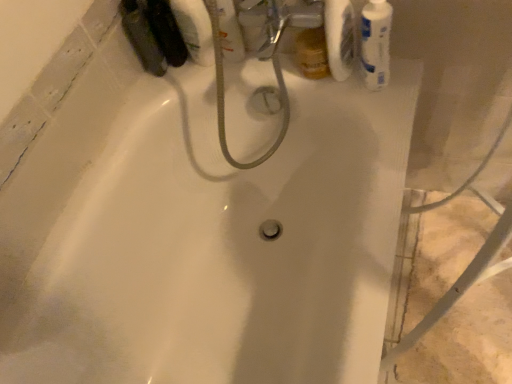
Where is `clear plastic bottle at upper center, which is the 2th mouthwash from right to left`? The height and width of the screenshot is (384, 512). clear plastic bottle at upper center, which is the 2th mouthwash from right to left is located at coordinates (227, 29).

Describe the element at coordinates (142, 37) in the screenshot. I see `matte black bottle at upper left, the third mouthwash in the right-to-left sequence` at that location.

Where is `matte black bottle at upper left, the 1th mouthwash in the left-to-right sequence`? matte black bottle at upper left, the 1th mouthwash in the left-to-right sequence is located at coordinates (142, 37).

What is the approximate height of white matte toilet paper at upper right?

9.28 inches.

Identify the location of clear plastic bottle at upper center, marked as the 2th mouthwash in a left-to-right arrangement. The width and height of the screenshot is (512, 384). (227, 29).

From a real-world perspective, is matte black bottle at upper left, the 1th mouthwash in the left-to-right sequence, physically located above or below white glossy mouthwash at upper right, arranged as the first mouthwash when viewed from the right?

matte black bottle at upper left, the 1th mouthwash in the left-to-right sequence, is below white glossy mouthwash at upper right, arranged as the first mouthwash when viewed from the right.

Between matte black bottle at upper left, the 1th mouthwash in the left-to-right sequence, and white glossy mouthwash at upper right, the 3th mouthwash from the left, which one has more height?

Standing taller between the two is white glossy mouthwash at upper right, the 3th mouthwash from the left.

Which object is closer to the camera taking this photo, matte black bottle at upper left, the third mouthwash in the right-to-left sequence, or white glossy mouthwash at upper right, arranged as the first mouthwash when viewed from the right?

white glossy mouthwash at upper right, arranged as the first mouthwash when viewed from the right, is more forward.

From the image's perspective, which one is positioned higher, matte black bottle at upper left, the 1th mouthwash in the left-to-right sequence, or white glossy mouthwash at upper right, the 3th mouthwash from the left?

matte black bottle at upper left, the 1th mouthwash in the left-to-right sequence.

Considering the points (221, 10) and (380, 29), which point is in front, point (221, 10) or point (380, 29)?

The point (380, 29) is closer.

Does clear plastic bottle at upper center, marked as the 2th mouthwash in a left-to-right arrangement, lie behind white glossy mouthwash at upper right, arranged as the first mouthwash when viewed from the right?

Yes, clear plastic bottle at upper center, marked as the 2th mouthwash in a left-to-right arrangement, is further from the camera.

Is clear plastic bottle at upper center, which is the 2th mouthwash from right to left, touching white glossy mouthwash at upper right, arranged as the first mouthwash when viewed from the right?

No, clear plastic bottle at upper center, which is the 2th mouthwash from right to left, is not next to white glossy mouthwash at upper right, arranged as the first mouthwash when viewed from the right.

Is clear plastic bottle at upper center, marked as the 2th mouthwash in a left-to-right arrangement, smaller than white glossy mouthwash at upper right, the 3th mouthwash from the left?

Yes, clear plastic bottle at upper center, marked as the 2th mouthwash in a left-to-right arrangement, is smaller than white glossy mouthwash at upper right, the 3th mouthwash from the left.

Is the depth of white glossy mouthwash at upper right, arranged as the first mouthwash when viewed from the right, less than that of white matte toilet paper at upper right?

Yes.

From the image's perspective, is white glossy mouthwash at upper right, arranged as the first mouthwash when viewed from the right, on top of white matte toilet paper at upper right?

Actually, white glossy mouthwash at upper right, arranged as the first mouthwash when viewed from the right, appears below white matte toilet paper at upper right in the image.

Where is `toilet paper above the white glossy mouthwash at upper right, arranged as the first mouthwash when viewed from the right (from a real-world perspective)`? The image size is (512, 384). toilet paper above the white glossy mouthwash at upper right, arranged as the first mouthwash when viewed from the right (from a real-world perspective) is located at coordinates (339, 37).

Who is more distant, white matte toilet paper at upper right or matte black bottle at upper left, the 1th mouthwash in the left-to-right sequence?

matte black bottle at upper left, the 1th mouthwash in the left-to-right sequence, is more distant.

Choose the correct answer: Is white matte toilet paper at upper right inside matte black bottle at upper left, the third mouthwash in the right-to-left sequence, or outside it?

white matte toilet paper at upper right is outside matte black bottle at upper left, the third mouthwash in the right-to-left sequence.

Is white matte toilet paper at upper right positioned with its back to matte black bottle at upper left, the 1th mouthwash in the left-to-right sequence?

No, matte black bottle at upper left, the 1th mouthwash in the left-to-right sequence, is not at the back of white matte toilet paper at upper right.

Does point (130, 26) come behind point (343, 80)?

Yes.

Can you confirm if matte black bottle at upper left, the 1th mouthwash in the left-to-right sequence, is shorter than white matte toilet paper at upper right?

Correct, matte black bottle at upper left, the 1th mouthwash in the left-to-right sequence, is not as tall as white matte toilet paper at upper right.

Which of these two, matte black bottle at upper left, the 1th mouthwash in the left-to-right sequence, or white matte toilet paper at upper right, is thinner?

With smaller width is white matte toilet paper at upper right.

Who is smaller, clear plastic bottle at upper center, marked as the 2th mouthwash in a left-to-right arrangement, or white matte toilet paper at upper right?

white matte toilet paper at upper right is smaller.

Measure the distance between clear plastic bottle at upper center, marked as the 2th mouthwash in a left-to-right arrangement, and white matte toilet paper at upper right.

The distance of clear plastic bottle at upper center, marked as the 2th mouthwash in a left-to-right arrangement, from white matte toilet paper at upper right is 9.12 inches.

From the image's perspective, is clear plastic bottle at upper center, which is the 2th mouthwash from right to left, under white matte toilet paper at upper right?

No, from the image's perspective, clear plastic bottle at upper center, which is the 2th mouthwash from right to left, is not beneath white matte toilet paper at upper right.

Can you confirm if white glossy mouthwash at upper right, the 3th mouthwash from the left, is positioned to the left of clear plastic bottle at upper center, marked as the 2th mouthwash in a left-to-right arrangement?

No.

Consider the image. From the image's perspective, which one is positioned lower, white glossy mouthwash at upper right, arranged as the first mouthwash when viewed from the right, or clear plastic bottle at upper center, which is the 2th mouthwash from right to left?

white glossy mouthwash at upper right, arranged as the first mouthwash when viewed from the right, appears lower in the image.

Who is more distant, white glossy mouthwash at upper right, arranged as the first mouthwash when viewed from the right, or clear plastic bottle at upper center, which is the 2th mouthwash from right to left?

clear plastic bottle at upper center, which is the 2th mouthwash from right to left, is more distant.

This screenshot has height=384, width=512. Find the location of `the 2nd mouthwash above when counting from the white glossy mouthwash at upper right, arranged as the first mouthwash when viewed from the right (from the image's perspective)`. the 2nd mouthwash above when counting from the white glossy mouthwash at upper right, arranged as the first mouthwash when viewed from the right (from the image's perspective) is located at coordinates (227, 29).

From a real-world perspective, which mouthwash is the 2nd one underneath the white glossy mouthwash at upper right, arranged as the first mouthwash when viewed from the right? Please provide its 2D coordinates.

[(142, 37)]

From the image's perspective, starting from the white glossy mouthwash at upper right, arranged as the first mouthwash when viewed from the right, which mouthwash is the 2nd one above? Please provide its 2D coordinates.

[(227, 29)]

From the image, which object appears to be farther from matte black bottle at upper left, the third mouthwash in the right-to-left sequence, white glossy mouthwash at upper right, arranged as the first mouthwash when viewed from the right, or clear plastic bottle at upper center, marked as the 2th mouthwash in a left-to-right arrangement?

white glossy mouthwash at upper right, arranged as the first mouthwash when viewed from the right, is further to matte black bottle at upper left, the third mouthwash in the right-to-left sequence.

Which object lies nearer to the anchor point white matte toilet paper at upper right, white glossy mouthwash at upper right, the 3th mouthwash from the left, or matte black bottle at upper left, the 1th mouthwash in the left-to-right sequence?

white glossy mouthwash at upper right, the 3th mouthwash from the left.

Based on their spatial positions, is white glossy mouthwash at upper right, arranged as the first mouthwash when viewed from the right, or matte black bottle at upper left, the third mouthwash in the right-to-left sequence, further from clear plastic bottle at upper center, which is the 2th mouthwash from right to left?

white glossy mouthwash at upper right, arranged as the first mouthwash when viewed from the right, lies further to clear plastic bottle at upper center, which is the 2th mouthwash from right to left, than the other object.

Looking at the image, which one is located further to white glossy mouthwash at upper right, arranged as the first mouthwash when viewed from the right, clear plastic bottle at upper center, which is the 2th mouthwash from right to left, or matte black bottle at upper left, the 1th mouthwash in the left-to-right sequence?

Based on the image, matte black bottle at upper left, the 1th mouthwash in the left-to-right sequence, appears to be further to white glossy mouthwash at upper right, arranged as the first mouthwash when viewed from the right.

Considering their positions, is matte black bottle at upper left, the third mouthwash in the right-to-left sequence, positioned closer to white glossy mouthwash at upper right, the 3th mouthwash from the left, than white matte toilet paper at upper right?

white matte toilet paper at upper right.

Which object lies nearer to the anchor point white matte toilet paper at upper right, matte black bottle at upper left, the third mouthwash in the right-to-left sequence, or white glossy mouthwash at upper right, arranged as the first mouthwash when viewed from the right?

white glossy mouthwash at upper right, arranged as the first mouthwash when viewed from the right, is positioned closer to the anchor white matte toilet paper at upper right.

Based on the photo, considering their positions, is white glossy mouthwash at upper right, the 3th mouthwash from the left, positioned further to white matte toilet paper at upper right than clear plastic bottle at upper center, marked as the 2th mouthwash in a left-to-right arrangement?

clear plastic bottle at upper center, marked as the 2th mouthwash in a left-to-right arrangement.

Consider the image. When comparing their distances from white matte toilet paper at upper right, does clear plastic bottle at upper center, which is the 2th mouthwash from right to left, or matte black bottle at upper left, the 1th mouthwash in the left-to-right sequence, seem further?

matte black bottle at upper left, the 1th mouthwash in the left-to-right sequence, is further to white matte toilet paper at upper right.

I want to click on mouthwash between matte black bottle at upper left, the 1th mouthwash in the left-to-right sequence, and white matte toilet paper at upper right, in the horizontal direction, so click(x=227, y=29).

Identify the location of toilet paper located between matte black bottle at upper left, the third mouthwash in the right-to-left sequence, and white glossy mouthwash at upper right, arranged as the first mouthwash when viewed from the right, in the left-right direction. (339, 37).

The width and height of the screenshot is (512, 384). I want to click on toilet paper between clear plastic bottle at upper center, marked as the 2th mouthwash in a left-to-right arrangement, and white glossy mouthwash at upper right, arranged as the first mouthwash when viewed from the right, in the horizontal direction, so click(339, 37).

Where is `mouthwash located between matte black bottle at upper left, the third mouthwash in the right-to-left sequence, and white glossy mouthwash at upper right, the 3th mouthwash from the left, in the left-right direction`? mouthwash located between matte black bottle at upper left, the third mouthwash in the right-to-left sequence, and white glossy mouthwash at upper right, the 3th mouthwash from the left, in the left-right direction is located at coordinates (227, 29).